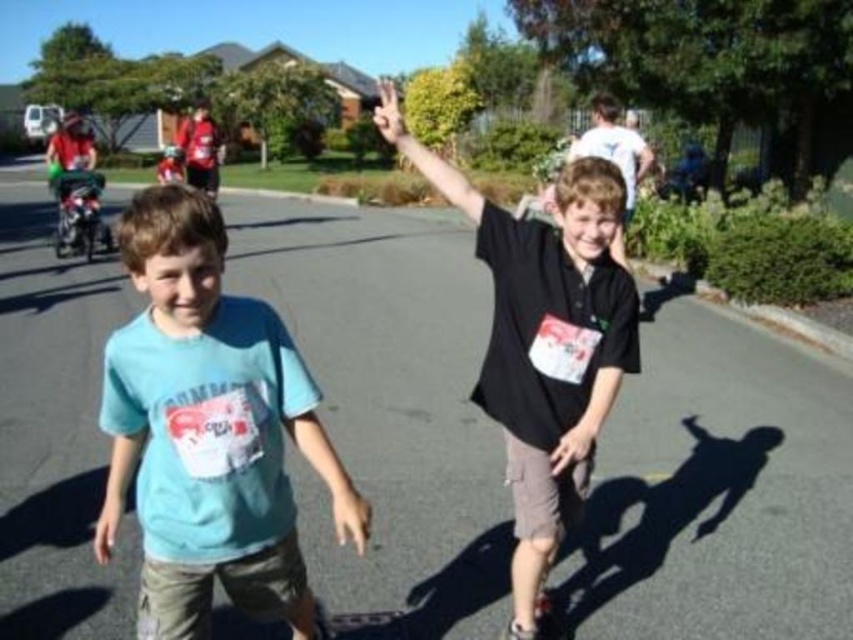
Question: Considering the real-world distances, which object is closest to the light blue cotton shirt at center?

Choices:
 (A) black matte shirt at center
 (B) matte black hand at center
 (C) white matte hand at center

Answer: (A)

Question: Among these points, which one is farthest from the camera?

Choices:
 (A) (517, 339)
 (B) (216, 346)

Answer: (A)

Question: Does light blue cotton shirt at center have a lesser width compared to white matte hand at center?

Choices:
 (A) yes
 (B) no

Answer: (A)

Question: Does light blue cotton shirt at center appear on the right side of black matte shirt at center?

Choices:
 (A) yes
 (B) no

Answer: (B)

Question: Is black matte shirt at center to the right of matte black hand at center from the viewer's perspective?

Choices:
 (A) yes
 (B) no

Answer: (B)

Question: Which point is farther to the camera?

Choices:
 (A) (215, 227)
 (B) (556, 444)
 (C) (399, 131)

Answer: (C)